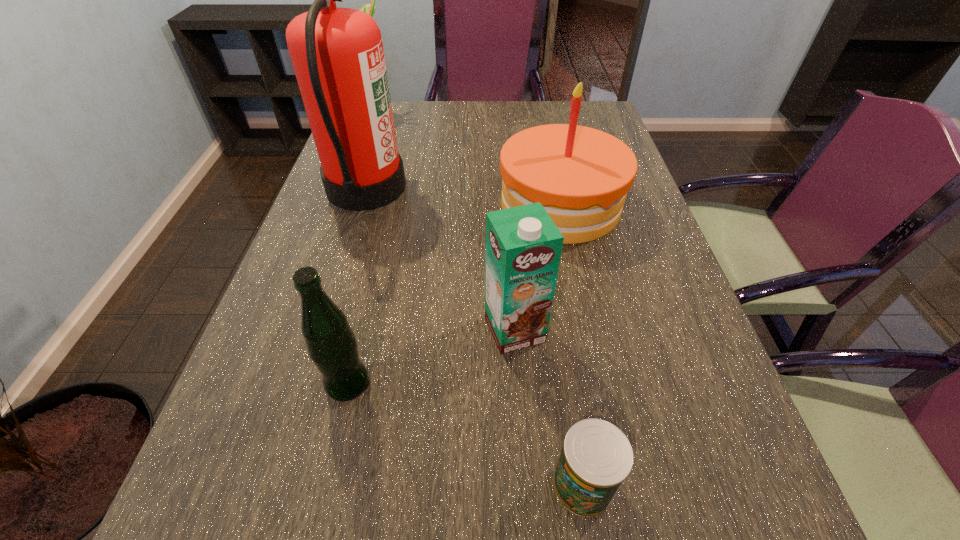
Identify the location of free region at the left edge. The image size is (960, 540). (296, 388).

Locate an element on the screen. The width and height of the screenshot is (960, 540). vacant area at the right edge of the desktop is located at coordinates (663, 350).

This screenshot has width=960, height=540. I want to click on free spot between the birthday cake and the alcohol, so click(x=468, y=160).

Locate an element on the screen. This screenshot has height=540, width=960. free area in between the farthest object and the birthday cake is located at coordinates (468, 160).

This screenshot has height=540, width=960. I want to click on vacant space in between the tallest object and the shortest object, so click(x=475, y=336).

The image size is (960, 540). I want to click on empty space that is in between the shortest object and the birthday cake, so click(572, 345).

Image resolution: width=960 pixels, height=540 pixels. What are the coordinates of `free spot between the fourth farthest object and the second nearest object` in the screenshot? It's located at (431, 357).

Find the location of `free space between the beer bottle and the alcohol`. free space between the beer bottle and the alcohol is located at coordinates (362, 249).

Locate an element on the screen. free spot between the beer bottle and the birthday cake is located at coordinates pos(454,295).

Locate an element on the screen. vacant space that is in between the birthday cake and the fire extinguisher is located at coordinates (464, 196).